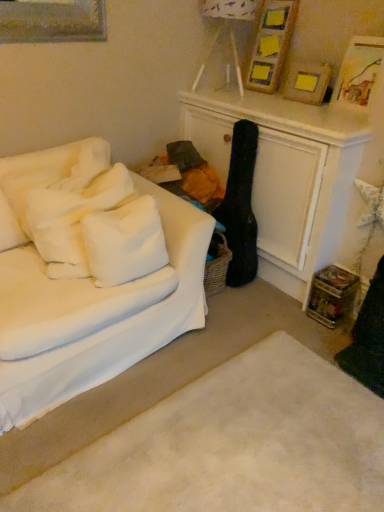
This screenshot has height=512, width=384. Describe the element at coordinates (271, 44) in the screenshot. I see `wooden frame with yellow squares at upper right, marked as the 1th picture frame in a left-to-right arrangement` at that location.

What do you see at coordinates (307, 82) in the screenshot?
I see `wooden picture frame at upper right, acting as the 2th picture frame starting from the left` at bounding box center [307, 82].

Where is `white soft pillows at left, positioned as the second pillow in right-to-left order`? Image resolution: width=384 pixels, height=512 pixels. white soft pillows at left, positioned as the second pillow in right-to-left order is located at coordinates 45,180.

The image size is (384, 512). What do you see at coordinates (45, 180) in the screenshot? I see `white soft pillows at left, positioned as the second pillow in right-to-left order` at bounding box center [45, 180].

Where is `wooden frame with yellow squares at upper right, the third picture frame from the right`? wooden frame with yellow squares at upper right, the third picture frame from the right is located at coordinates (271, 44).

Considering the relative sizes of white soft pillows at left, positioned as the second pillow in right-to-left order, and wooden picture frame at upper right, acting as the 2th picture frame starting from the left, in the image provided, is white soft pillows at left, positioned as the second pillow in right-to-left order, thinner than wooden picture frame at upper right, acting as the 2th picture frame starting from the left,?

In fact, white soft pillows at left, positioned as the second pillow in right-to-left order, might be wider than wooden picture frame at upper right, acting as the 2th picture frame starting from the left.

Between white soft pillows at left, positioned as the second pillow in right-to-left order, and wooden picture frame at upper right, acting as the 2th picture frame starting from the left, which one has more height?

white soft pillows at left, positioned as the second pillow in right-to-left order.

From a real-world perspective, who is located higher, white soft pillows at left, positioned as the second pillow in right-to-left order, or wooden picture frame at upper right, acting as the 2th picture frame starting from the left?

wooden picture frame at upper right, acting as the 2th picture frame starting from the left.

Is white soft pillows at left, the 1th pillow when ordered from left to right, at the left side of wooden picture frame at upper right, which is the second picture frame from right to left?

Yes.

Does wooden picture frame at upper right, arranged as the 1th picture frame when viewed from the right, have a lesser width compared to white soft pillows at left, the 1th pillow when ordered from left to right?

Yes.

Between wooden picture frame at upper right, which ranks as the 3th picture frame in left-to-right order, and white soft pillows at left, positioned as the second pillow in right-to-left order, which one is positioned behind?

wooden picture frame at upper right, which ranks as the 3th picture frame in left-to-right order.

From a real-world perspective, which is physically above, wooden picture frame at upper right, which ranks as the 3th picture frame in left-to-right order, or white soft pillows at left, the 1th pillow when ordered from left to right?

From a 3D spatial view, wooden picture frame at upper right, which ranks as the 3th picture frame in left-to-right order, is above.

Based on their sizes in the image, would you say wooden picture frame at upper right, arranged as the 1th picture frame when viewed from the right, is bigger or smaller than white soft pillows at left, positioned as the second pillow in right-to-left order?

wooden picture frame at upper right, arranged as the 1th picture frame when viewed from the right, is smaller than white soft pillows at left, positioned as the second pillow in right-to-left order.

In the scene shown: Considering the relative sizes of white soft rug at lower center and wooden picture frame at upper right, arranged as the 1th picture frame when viewed from the right, in the image provided, is white soft rug at lower center smaller than wooden picture frame at upper right, arranged as the 1th picture frame when viewed from the right,?

Actually, white soft rug at lower center might be larger than wooden picture frame at upper right, arranged as the 1th picture frame when viewed from the right.

What's the angular difference between white soft rug at lower center and wooden picture frame at upper right, which ranks as the 3th picture frame in left-to-right order,'s facing directions?

The angle between the facing direction of white soft rug at lower center and the facing direction of wooden picture frame at upper right, which ranks as the 3th picture frame in left-to-right order, is 85.3 degrees.

How distant is white soft rug at lower center from wooden picture frame at upper right, which ranks as the 3th picture frame in left-to-right order?

They are 1.68 meters apart.

Can you confirm if white soft rug at lower center is taller than wooden picture frame at upper right, which ranks as the 3th picture frame in left-to-right order?

Incorrect, the height of white soft rug at lower center is not larger of that of wooden picture frame at upper right, which ranks as the 3th picture frame in left-to-right order.

From a real-world perspective, is white fabric couch at left under wooden picture frame at upper right, arranged as the 1th picture frame when viewed from the right?

Yes.

Which of these two, white fabric couch at left or wooden picture frame at upper right, arranged as the 1th picture frame when viewed from the right, stands taller?

white fabric couch at left is taller.

Is white fabric couch at left wider than wooden picture frame at upper right, which ranks as the 3th picture frame in left-to-right order?

Yes, white fabric couch at left is wider than wooden picture frame at upper right, which ranks as the 3th picture frame in left-to-right order.

Would you say white fabric couch at left is outside wooden picture frame at upper right, which ranks as the 3th picture frame in left-to-right order?

Indeed, white fabric couch at left is completely outside wooden picture frame at upper right, which ranks as the 3th picture frame in left-to-right order.

In terms of height, does white fabric couch at left look taller or shorter compared to wooden frame with yellow squares at upper right, marked as the 1th picture frame in a left-to-right arrangement?

white fabric couch at left is taller than wooden frame with yellow squares at upper right, marked as the 1th picture frame in a left-to-right arrangement.

Consider the image. From a real-world perspective, is white fabric couch at left over wooden frame with yellow squares at upper right, the third picture frame from the right?

No, from a real-world perspective, white fabric couch at left is not above wooden frame with yellow squares at upper right, the third picture frame from the right.

Would you say white fabric couch at left is inside or outside wooden frame with yellow squares at upper right, the third picture frame from the right?

white fabric couch at left is not inside wooden frame with yellow squares at upper right, the third picture frame from the right, it's outside.

Could you tell me if wooden frame with yellow squares at upper right, marked as the 1th picture frame in a left-to-right arrangement, is facing wooden picture frame at upper right, acting as the 2th picture frame starting from the left?

No, wooden frame with yellow squares at upper right, marked as the 1th picture frame in a left-to-right arrangement, is not aimed at wooden picture frame at upper right, acting as the 2th picture frame starting from the left.

Between wooden frame with yellow squares at upper right, marked as the 1th picture frame in a left-to-right arrangement, and wooden picture frame at upper right, which is the second picture frame from right to left, which one has larger width?

Wider between the two is wooden frame with yellow squares at upper right, marked as the 1th picture frame in a left-to-right arrangement.

Considering their positions, is wooden frame with yellow squares at upper right, marked as the 1th picture frame in a left-to-right arrangement, located in front of or behind wooden picture frame at upper right, which is the second picture frame from right to left?

Clearly, wooden frame with yellow squares at upper right, marked as the 1th picture frame in a left-to-right arrangement, is behind wooden picture frame at upper right, which is the second picture frame from right to left.

Is wooden frame with yellow squares at upper right, the third picture frame from the right, placed right next to wooden picture frame at upper right, acting as the 2th picture frame starting from the left?

No.

From a real-world perspective, who is located higher, wooden frame with yellow squares at upper right, marked as the 1th picture frame in a left-to-right arrangement, or wooden picture frame at upper right, arranged as the 1th picture frame when viewed from the right?

wooden frame with yellow squares at upper right, marked as the 1th picture frame in a left-to-right arrangement.

Is wooden picture frame at upper right, which ranks as the 3th picture frame in left-to-right order, located within wooden frame with yellow squares at upper right, the third picture frame from the right?

No, wooden picture frame at upper right, which ranks as the 3th picture frame in left-to-right order, is not a part of wooden frame with yellow squares at upper right, the third picture frame from the right.

Which object is closer to the camera taking this photo, wooden frame with yellow squares at upper right, the third picture frame from the right, or wooden picture frame at upper right, which ranks as the 3th picture frame in left-to-right order?

wooden picture frame at upper right, which ranks as the 3th picture frame in left-to-right order, is in front.

From the image's perspective, relative to wooden picture frame at upper right, which ranks as the 3th picture frame in left-to-right order, is wooden frame with yellow squares at upper right, marked as the 1th picture frame in a left-to-right arrangement, above or below?

From the image's perspective, wooden frame with yellow squares at upper right, marked as the 1th picture frame in a left-to-right arrangement, appears above wooden picture frame at upper right, which ranks as the 3th picture frame in left-to-right order.

From the wooden picture frame at upper right, acting as the 2th picture frame starting from the left, count 1st pillows forward and point to it. Please provide its 2D coordinates.

[(45, 180)]

From the image's perspective, count 1st pillows downward from the wooden picture frame at upper right, which ranks as the 3th picture frame in left-to-right order, and point to it. Please provide its 2D coordinates.

[(45, 180)]

From the picture: Based on their spatial positions, is wooden picture frame at upper right, which ranks as the 3th picture frame in left-to-right order, or white soft rug at lower center closer to white fluffy pillow at left, the first pillow in the right-to-left sequence?

Among the two, white soft rug at lower center is located nearer to white fluffy pillow at left, the first pillow in the right-to-left sequence.

Based on their spatial positions, is white fabric couch at left or white soft rug at lower center further from wooden picture frame at upper right, which ranks as the 3th picture frame in left-to-right order?

Based on the image, white soft rug at lower center appears to be further to wooden picture frame at upper right, which ranks as the 3th picture frame in left-to-right order.

When comparing their distances from wooden picture frame at upper right, acting as the 2th picture frame starting from the left, does white fabric couch at left or wooden picture frame at upper right, which ranks as the 3th picture frame in left-to-right order, seem closer?

Among the two, wooden picture frame at upper right, which ranks as the 3th picture frame in left-to-right order, is located nearer to wooden picture frame at upper right, acting as the 2th picture frame starting from the left.

Considering their positions, is white fluffy pillow at left, the first pillow in the right-to-left sequence, positioned closer to wooden picture frame at upper right, acting as the 2th picture frame starting from the left, than wooden picture frame at upper right, arranged as the 1th picture frame when viewed from the right?

wooden picture frame at upper right, arranged as the 1th picture frame when viewed from the right, is closer to wooden picture frame at upper right, acting as the 2th picture frame starting from the left.

Consider the image. Considering their positions, is wooden frame with yellow squares at upper right, marked as the 1th picture frame in a left-to-right arrangement, positioned closer to white fabric couch at left than white soft rug at lower center?

white soft rug at lower center is positioned closer to the anchor white fabric couch at left.

Estimate the real-world distances between objects in this image. Which object is further from white soft rug at lower center, white fabric couch at left or wooden picture frame at upper right, arranged as the 1th picture frame when viewed from the right?

wooden picture frame at upper right, arranged as the 1th picture frame when viewed from the right, lies further to white soft rug at lower center than the other object.

From the image, which object appears to be farther from wooden picture frame at upper right, arranged as the 1th picture frame when viewed from the right, white fabric couch at left or wooden frame with yellow squares at upper right, marked as the 1th picture frame in a left-to-right arrangement?

white fabric couch at left lies further to wooden picture frame at upper right, arranged as the 1th picture frame when viewed from the right, than the other object.

From the image, which object appears to be farther from white fabric couch at left, wooden frame with yellow squares at upper right, the third picture frame from the right, or wooden picture frame at upper right, acting as the 2th picture frame starting from the left?

wooden frame with yellow squares at upper right, the third picture frame from the right.

You are a GUI agent. You are given a task and a screenshot of the screen. Output one action in this format:
    pyautogui.click(x=<x>, y=<y>)
    Task: Click on the pillow between white fabric couch at left and wooden picture frame at upper right, arranged as the 1th picture frame when viewed from the right, in the horizontal direction
    The width and height of the screenshot is (384, 512).
    Given the screenshot: What is the action you would take?
    pyautogui.click(x=124, y=242)

The image size is (384, 512). Identify the location of picture frame between wooden picture frame at upper right, which is the second picture frame from right to left, and white soft rug at lower center in the up-down direction. (358, 72).

At what (x,y) coordinates should I click in order to perform the action: click on studio couch between white soft pillows at left, positioned as the second pillow in right-to-left order, and white soft rug at lower center, in the vertical direction. Please return your answer as a coordinate pair (x, y). This screenshot has width=384, height=512. Looking at the image, I should click on (89, 274).

You are a GUI agent. You are given a task and a screenshot of the screen. Output one action in this format:
    pyautogui.click(x=<x>, y=<y>)
    Task: Click on the studio couch between white soft pillows at left, positioned as the second pillow in right-to-left order, and wooden picture frame at upper right, which is the second picture frame from right to left, from left to right
    This screenshot has height=512, width=384.
    Given the screenshot: What is the action you would take?
    pyautogui.click(x=89, y=274)